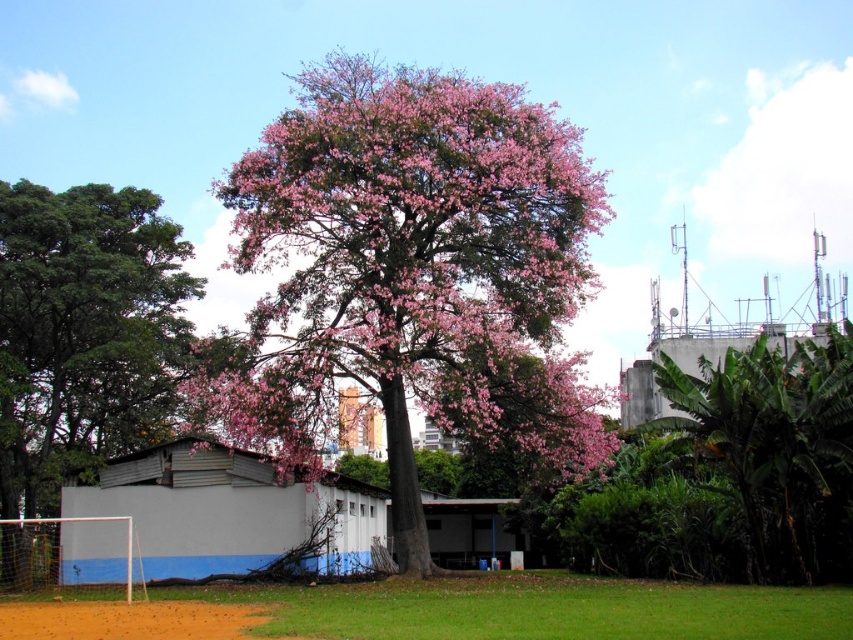
You are standing at the center of the image looking towards the soccer goalpost. Which object is closer to you between the brown dirt field at lower left and the green leafy tree at right?

The brown dirt field at lower left is closer to you because it is positioned below the green leafy tree at right, meaning it is in a lower plane and thus nearer in the visual perspective.

You are standing at the point marked by the coordinates point (413,273) in the scene. Looking around, you see the pink matte tree at center. What is the nearest object to you in this location?

The nearest object to you at point (413,273) is the pink matte tree at center since the coordinates mark its location.